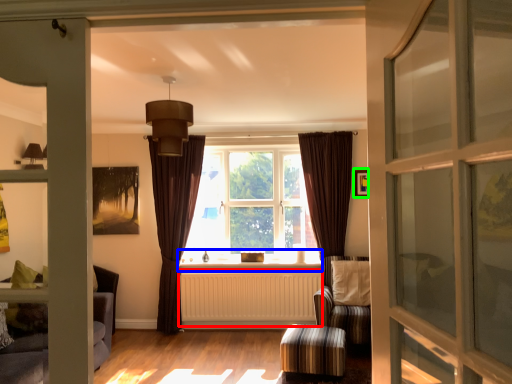
Question: Which object is the farthest from radiator (highlighted by a red box)? Choose among these: window sill (highlighted by a blue box) or picture frame (highlighted by a green box).

Choices:
 (A) window sill
 (B) picture frame

Answer: (B)